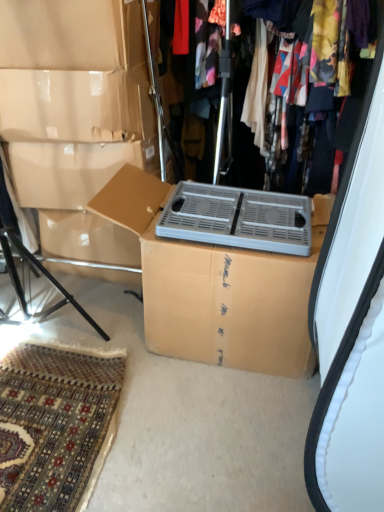
Question: Would you say cardboard box at center is part of gray plastic crate at center's contents?

Choices:
 (A) yes
 (B) no

Answer: (B)

Question: Does gray plastic crate at center have a greater height compared to cardboard box at center?

Choices:
 (A) no
 (B) yes

Answer: (A)

Question: Could you tell me if gray plastic crate at center is turned towards cardboard box at center?

Choices:
 (A) no
 (B) yes

Answer: (B)

Question: Does gray plastic crate at center touch cardboard box at center?

Choices:
 (A) no
 (B) yes

Answer: (A)

Question: Does gray plastic crate at center have a lesser width compared to cardboard box at center?

Choices:
 (A) yes
 (B) no

Answer: (A)

Question: From the image's perspective, is metallic silver heater at upper center located above or below gray plastic crate at center?

Choices:
 (A) above
 (B) below

Answer: (A)

Question: Is metallic silver heater at upper center bigger or smaller than gray plastic crate at center?

Choices:
 (A) small
 (B) big

Answer: (B)

Question: In terms of width, does metallic silver heater at upper center look wider or thinner when compared to gray plastic crate at center?

Choices:
 (A) thin
 (B) wide

Answer: (B)

Question: Considering the positions of point (360, 41) and point (261, 225), is point (360, 41) closer or farther from the camera than point (261, 225)?

Choices:
 (A) closer
 (B) farther

Answer: (B)

Question: Considering the relative positions of metallic silver heater at upper center and cardboard box at center in the image provided, is metallic silver heater at upper center to the left or to the right of cardboard box at center?

Choices:
 (A) right
 (B) left

Answer: (A)

Question: From a real-world perspective, is metallic silver heater at upper center above or below cardboard box at center?

Choices:
 (A) below
 (B) above

Answer: (B)

Question: Is metallic silver heater at upper center taller or shorter than cardboard box at center?

Choices:
 (A) short
 (B) tall

Answer: (B)

Question: Looking at their shapes, would you say metallic silver heater at upper center is wider or thinner than cardboard box at center?

Choices:
 (A) thin
 (B) wide

Answer: (A)

Question: Is point (127, 174) positioned closer to the camera than point (228, 228)?

Choices:
 (A) closer
 (B) farther

Answer: (B)

Question: Is cardboard box at center inside or outside of gray plastic crate at center?

Choices:
 (A) outside
 (B) inside

Answer: (A)